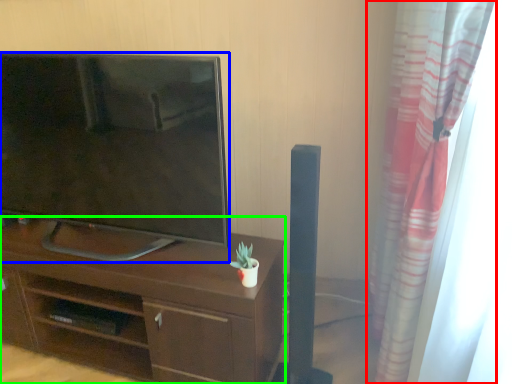
Question: Estimate the real-world distances between objects in this image. Which object is closer to curtain (highlighted by a red box), television (highlighted by a blue box) or desk (highlighted by a green box)?

Choices:
 (A) television
 (B) desk

Answer: (B)